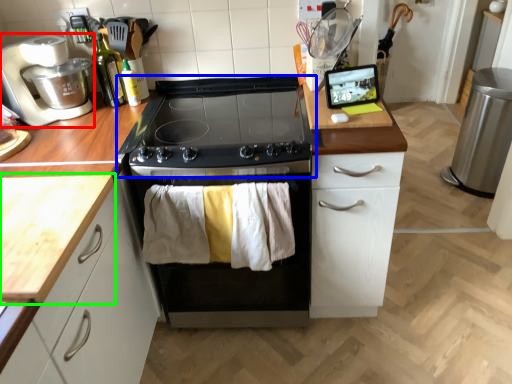
Question: Considering the real-world distances, which object is farthest from kitchen appliance (highlighted by a red box)? gas stove (highlighted by a blue box) or countertop (highlighted by a green box)?

Choices:
 (A) gas stove
 (B) countertop

Answer: (B)